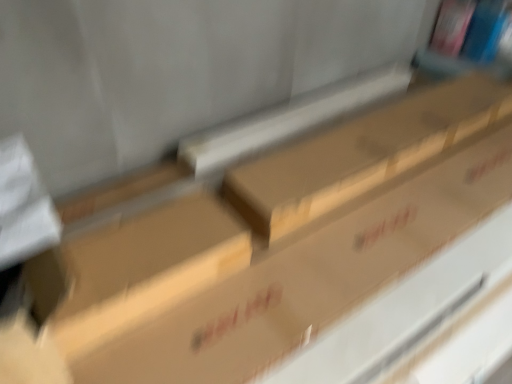
Identify the location of brown cardboard box at center. Image resolution: width=512 pixels, height=384 pixels. (153, 253).

What do you see at coordinates (153, 253) in the screenshot? I see `brown cardboard box at center` at bounding box center [153, 253].

Describe the element at coordinates (361, 154) in the screenshot. This screenshot has height=384, width=512. I see `brown cardboard box at center` at that location.

This screenshot has width=512, height=384. What are the coordinates of `brown cardboard box at center` in the screenshot? It's located at (361, 154).

Where is `brown cardboard box at center`? This screenshot has height=384, width=512. brown cardboard box at center is located at coordinates (153, 253).

Can you confirm if brown cardboard box at center is positioned to the right of brown cardboard box at center?

Correct, you'll find brown cardboard box at center to the right of brown cardboard box at center.

Does brown cardboard box at center lie in front of brown cardboard box at center?

No, brown cardboard box at center is behind brown cardboard box at center.

Between point (275, 200) and point (103, 280), which one is positioned in front?

The point (103, 280) is in front.

From the image's perspective, between brown cardboard box at center and brown cardboard box at center, who is located below?

brown cardboard box at center appears lower in the image.

From a real-world perspective, which is physically below, brown cardboard box at center or brown cardboard box at center?

brown cardboard box at center is physically lower.

Looking at this image, is brown cardboard box at center wider or thinner than brown cardboard box at center?

Considering their sizes, brown cardboard box at center looks slimmer than brown cardboard box at center.

Considering the relative sizes of brown cardboard box at center and brown cardboard box at center in the image provided, is brown cardboard box at center taller than brown cardboard box at center?

Indeed, brown cardboard box at center has a greater height compared to brown cardboard box at center.

Is brown cardboard box at center bigger than brown cardboard box at center?

Yes.

Choose the correct answer: Is brown cardboard box at center inside brown cardboard box at center or outside it?

brown cardboard box at center is not enclosed by brown cardboard box at center.

Would you say brown cardboard box at center is a long distance from brown cardboard box at center?

No.

Does brown cardboard box at center turn towards brown cardboard box at center?

No, brown cardboard box at center does not turn towards brown cardboard box at center.

Identify the location of box on the right of brown cardboard box at center. (361, 154).

Between brown cardboard box at center and brown cardboard box at center, which one appears on the right side from the viewer's perspective?

From the viewer's perspective, brown cardboard box at center appears more on the right side.

Looking at this image, considering the relative positions of brown cardboard box at center and brown cardboard box at center in the image provided, is brown cardboard box at center behind brown cardboard box at center?

No, brown cardboard box at center is closer to the viewer.

Which is in front, point (166, 218) or point (362, 159)?

The point (166, 218) is closer.

From the image's perspective, is brown cardboard box at center beneath brown cardboard box at center?

Yes, from the image's perspective, brown cardboard box at center is below brown cardboard box at center.

From a real-world perspective, is brown cardboard box at center positioned under brown cardboard box at center based on gravity?

Indeed, from a real-world perspective, brown cardboard box at center is positioned beneath brown cardboard box at center.

Considering the sizes of objects brown cardboard box at center and brown cardboard box at center in the image provided, who is thinner, brown cardboard box at center or brown cardboard box at center?

Thinner between the two is brown cardboard box at center.

Considering the relative sizes of brown cardboard box at center and brown cardboard box at center in the image provided, is brown cardboard box at center taller than brown cardboard box at center?

Incorrect, the height of brown cardboard box at center is not larger of that of brown cardboard box at center.

Which of these two, brown cardboard box at center or brown cardboard box at center, is smaller?

Smaller between the two is brown cardboard box at center.

Is brown cardboard box at center located outside brown cardboard box at center?

That's correct, brown cardboard box at center is outside of brown cardboard box at center.

Is brown cardboard box at center far from brown cardboard box at center?

That's not correct — brown cardboard box at center is a little close to brown cardboard box at center.

Is brown cardboard box at center positioned with its back to brown cardboard box at center?

No, brown cardboard box at center's orientation is not away from brown cardboard box at center.

How many degrees apart are the facing directions of brown cardboard box at center and brown cardboard box at center?

There is a 0.000435-degree angle between the facing directions of brown cardboard box at center and brown cardboard box at center.

The height and width of the screenshot is (384, 512). I want to click on block on the left of brown cardboard box at center, so click(153, 253).

At what (x,y) coordinates should I click in order to perform the action: click on box above the brown cardboard box at center (from a real-world perspective). Please return your answer as a coordinate pair (x, y). Image resolution: width=512 pixels, height=384 pixels. Looking at the image, I should click on (x=361, y=154).

The width and height of the screenshot is (512, 384). I want to click on box lying on the right of brown cardboard box at center, so click(x=361, y=154).